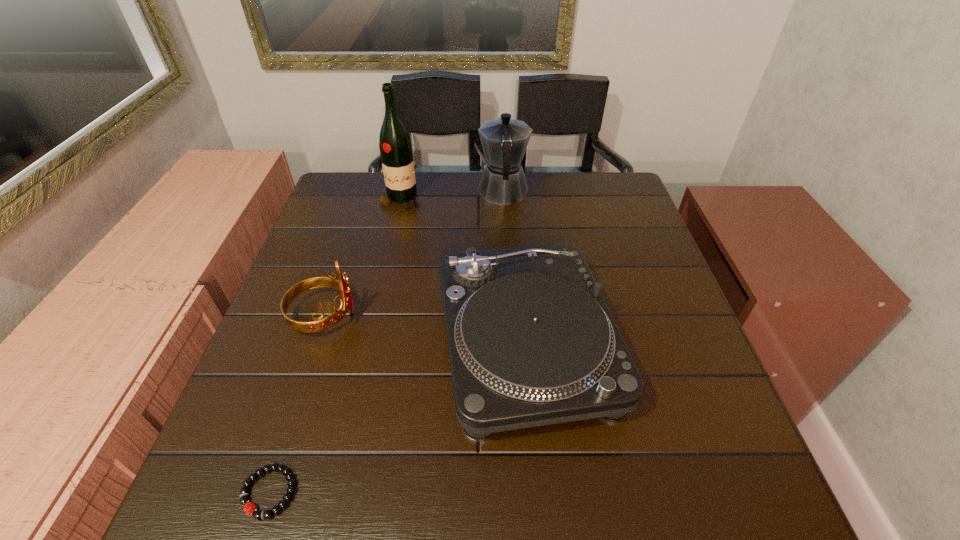
Where is `free space between the tallest object and the tiara`? free space between the tallest object and the tiara is located at coordinates pyautogui.click(x=362, y=258).

Where is `free space between the record player and the shortest object`? The image size is (960, 540). free space between the record player and the shortest object is located at coordinates (397, 417).

This screenshot has height=540, width=960. I want to click on object that ranks as the second closest to the coffeepot, so click(x=531, y=340).

The image size is (960, 540). Identify the location of object identified as the second closest to the bracelet. (320, 324).

Identify the location of free space that satisfies the following two spatial constraints: 1. on the front side of the wine bottle; 2. on the front-facing side of the tiara. The image size is (960, 540). (372, 316).

This screenshot has width=960, height=540. Identify the location of vacant space that satisfies the following two spatial constraints: 1. on the back side of the tallest object; 2. on the right side of the bracelet. (366, 200).

At what (x,y) coordinates should I click in order to perform the action: click on free space that satisfies the following two spatial constraints: 1. on the front-facing side of the tiara; 2. on the back side of the second shortest object. Please return your answer as a coordinate pair (x, y). Looking at the image, I should click on (315, 343).

Where is `free space that satisfies the following two spatial constraints: 1. on the front-facing side of the tiara; 2. on the left side of the second shortest object`? This screenshot has width=960, height=540. free space that satisfies the following two spatial constraints: 1. on the front-facing side of the tiara; 2. on the left side of the second shortest object is located at coordinates (315, 343).